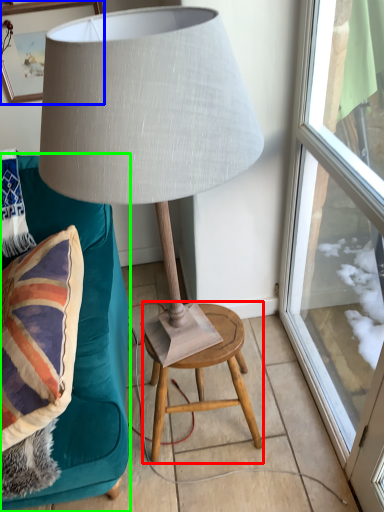
Question: Which object is the closest to the stool (highlighted by a red box)? Choose among these: picture frame (highlighted by a blue box) or furniture (highlighted by a green box).

Choices:
 (A) picture frame
 (B) furniture

Answer: (B)